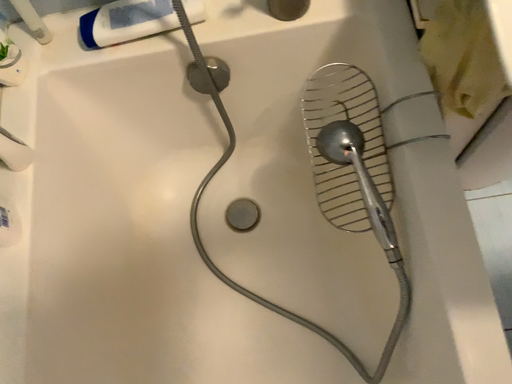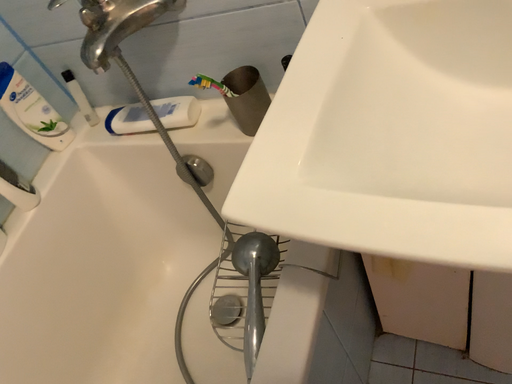
Question: How did the camera likely rotate when shooting the video?

Choices:
 (A) rotated downward
 (B) rotated upward

Answer: (B)